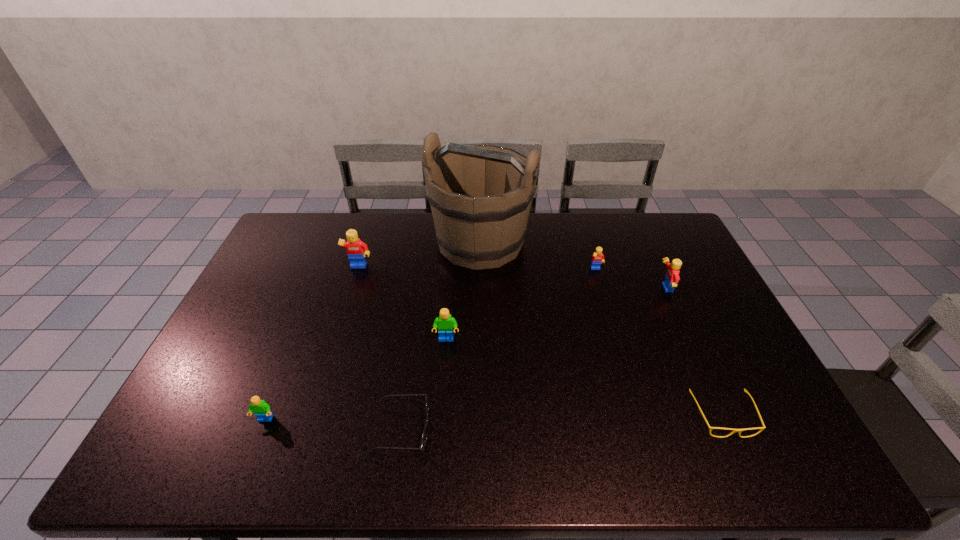
Locate an element on the screen. Image resolution: width=960 pixels, height=540 pixels. object that is the sixth closest to the beige spectacles is located at coordinates (356, 249).

Identify the location of Lego that is the fourth closest to the smallest yellow Lego. (262, 410).

Point out which Lego is positioned as the second nearest to the nearest Lego. Please provide its 2D coordinates. Your answer should be formatted as a tuple, i.e. [(x, y)], where the tuple contains the x and y coordinates of a point satisfying the conditions above.

[(356, 249)]

In order to click on yellow Lego that is the nearest to the bucket in this screenshot , I will do [x=597, y=258].

This screenshot has height=540, width=960. What are the coordinates of `yellow Lego that is the second closest to the leftmost yellow Lego` in the screenshot? It's located at (672, 277).

This screenshot has height=540, width=960. Identify the location of vacant space that satisfies the following two spatial constraints: 1. on the face of the sixth object from left to right; 2. on the front-facing side of the left spectacles. (644, 430).